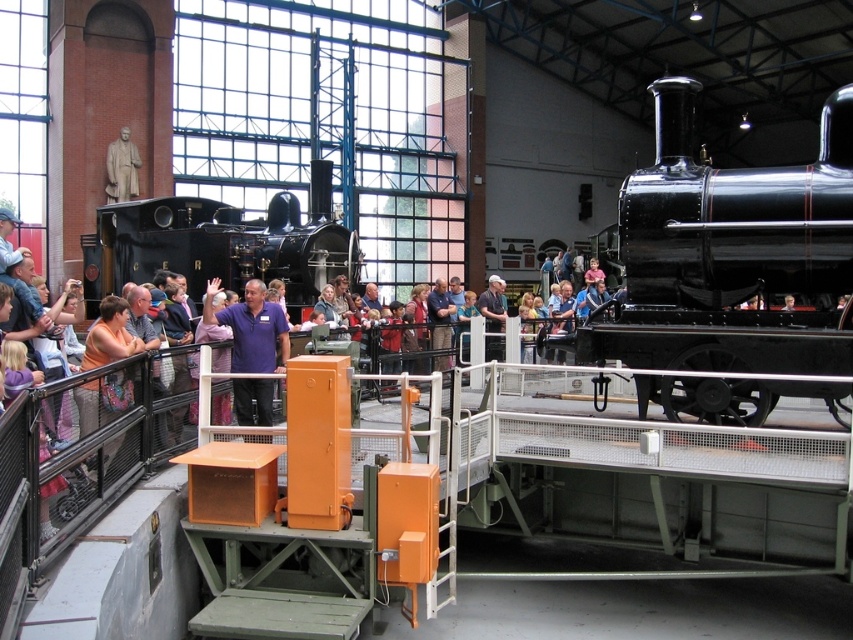
Between black polished locomotive at center and purple shirt at center, which one has more height?

purple shirt at center is taller.

Is point (735, 380) closer to camera compared to point (236, 304)?

Yes, point (735, 380) is in front of point (236, 304).

You are a GUI agent. You are given a task and a screenshot of the screen. Output one action in this format:
    pyautogui.click(x=<x>, y=<y>)
    Task: Click on the black polished locomotive at center
    This screenshot has height=640, width=853.
    Given the screenshot: What is the action you would take?
    pyautogui.click(x=730, y=256)

Does black polished locomotive at center appear on the right side of polished black steam locomotive at center?

Indeed, black polished locomotive at center is positioned on the right side of polished black steam locomotive at center.

Between black polished locomotive at center and polished black steam locomotive at center, which one appears on the left side from the viewer's perspective?

polished black steam locomotive at center

At what (x,y) coordinates should I click in order to perform the action: click on black polished locomotive at center. Please return your answer as a coordinate pair (x, y). Looking at the image, I should click on (730, 256).

Is point (193, 198) farther from camera compared to point (209, 285)?

Yes, point (193, 198) is farther from viewer.

Is point (183, 272) positioned in front of point (248, 369)?

No.

This screenshot has width=853, height=640. I want to click on polished black steam locomotive at center, so click(x=219, y=243).